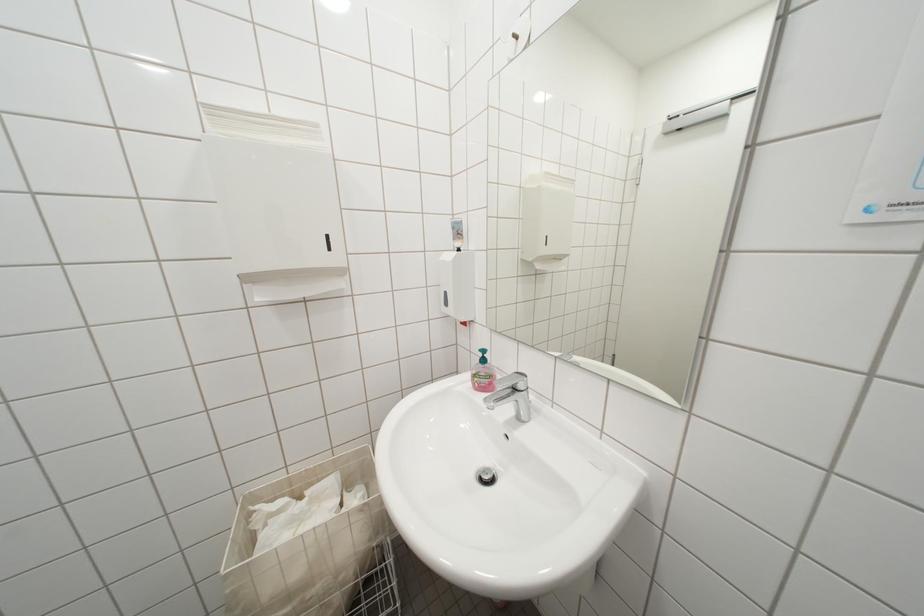
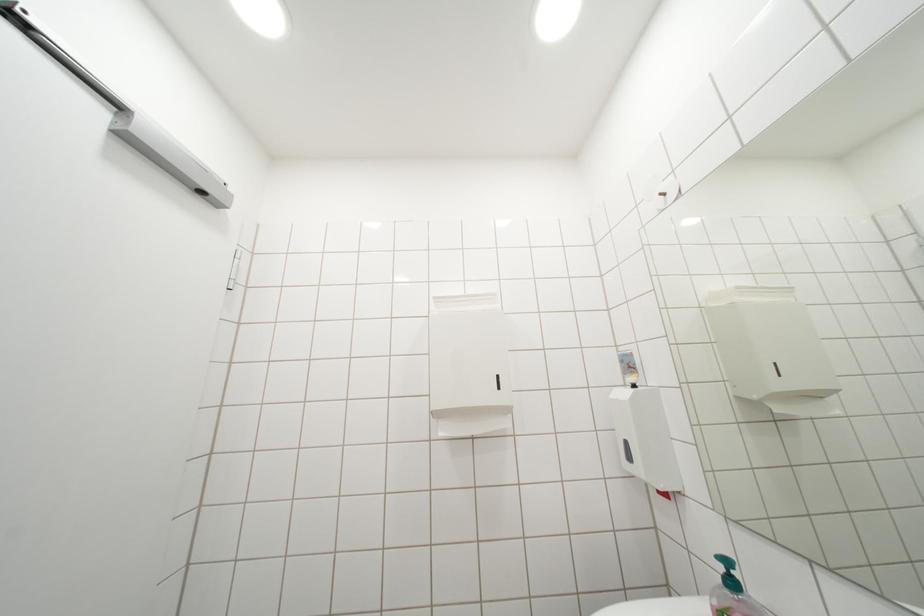
First-person continuous shooting, in which direction is the camera rotating?

The camera's rotation is toward left-up.